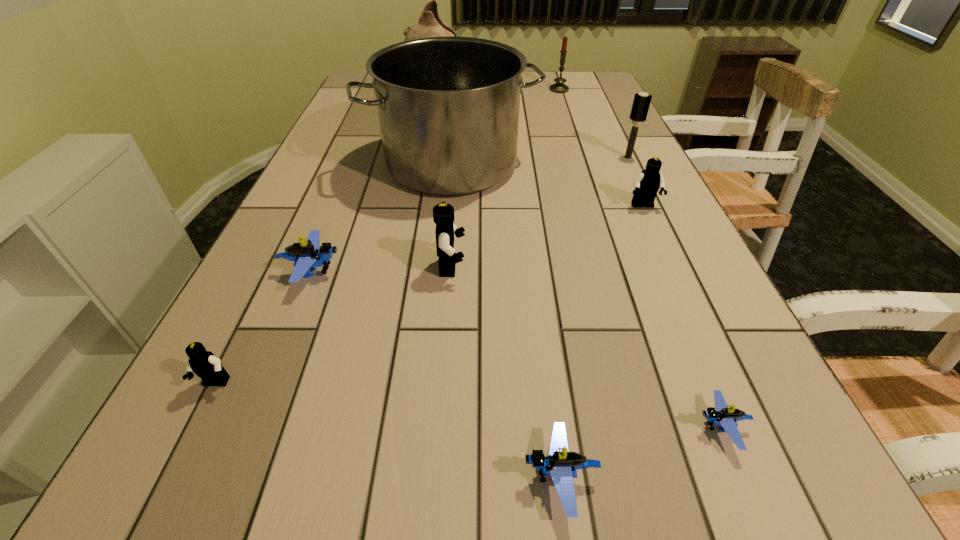
I want to click on free space between the nearest black Lego and the sixth shortest object, so point(333,326).

Find the location of a particular element. This screenshot has height=540, width=960. vacant region between the third Lego from right to left and the shortest object is located at coordinates (640, 453).

Locate an element on the screen. The height and width of the screenshot is (540, 960). vacant region between the hairbrush and the biggest blue Lego is located at coordinates (470, 214).

Where is `vacant space in between the second shortest object and the biggest black Lego`? vacant space in between the second shortest object and the biggest black Lego is located at coordinates (506, 372).

Image resolution: width=960 pixels, height=540 pixels. I want to click on empty space between the saucepan and the farthest blue Lego, so click(382, 218).

Identify the location of free space between the farthest blue Lego and the fourth farthest Lego. (264, 327).

Where is `vacant space that's between the red candle and the third Lego from left to right`? This screenshot has width=960, height=540. vacant space that's between the red candle and the third Lego from left to right is located at coordinates point(505,178).

Image resolution: width=960 pixels, height=540 pixels. What are the coordinates of `vacant space that's between the biggest blue Lego and the tallest Lego` in the screenshot? It's located at (382, 269).

The height and width of the screenshot is (540, 960). What are the coordinates of `vacant space that's between the hairbrush and the nearest black Lego` in the screenshot? It's located at (421, 271).

Where is `object that stands as the closest to the hairbrush`? The height and width of the screenshot is (540, 960). object that stands as the closest to the hairbrush is located at coordinates (647, 183).